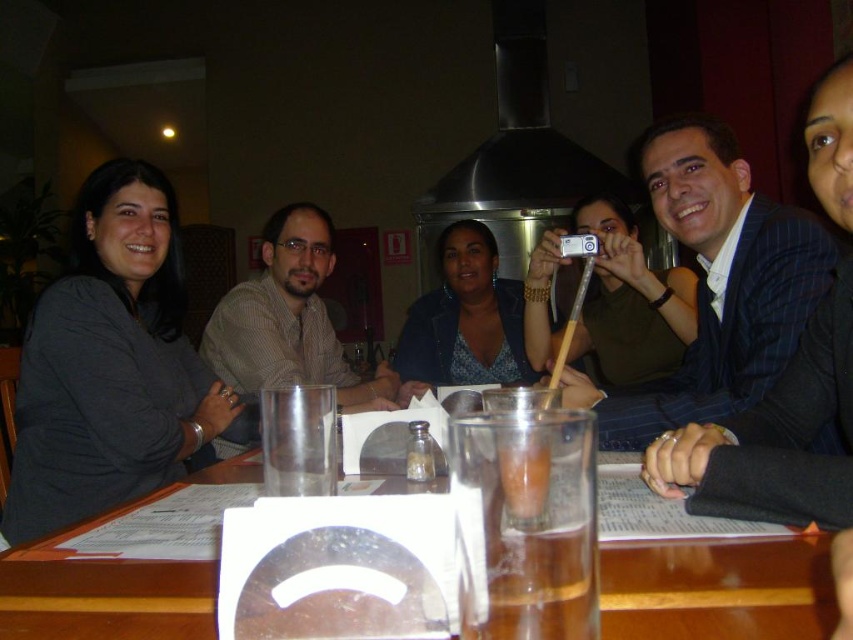
Consider the image. You are a photographer taking a group photo of the six people around the wooden table. You notice the dark blue suit at center and the matte brown shirt at center. Which clothing item should you focus on if you want to capture the larger one in your frame?

The matte brown shirt at center is larger than the dark blue suit at center, so you should focus on the matte brown shirt at center to capture the larger one in your frame.